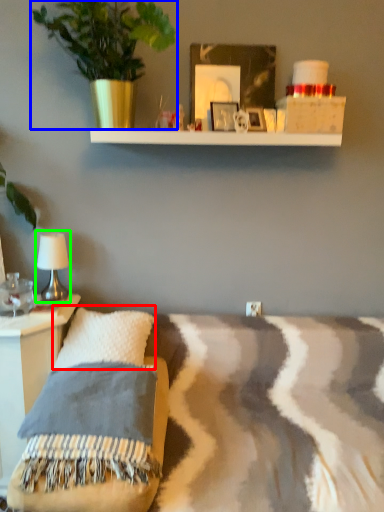
Question: Which object is positioned closest to pillow (highlighted by a red box)? Select from houseplant (highlighted by a blue box) and table lamp (highlighted by a green box).

Choices:
 (A) houseplant
 (B) table lamp

Answer: (B)